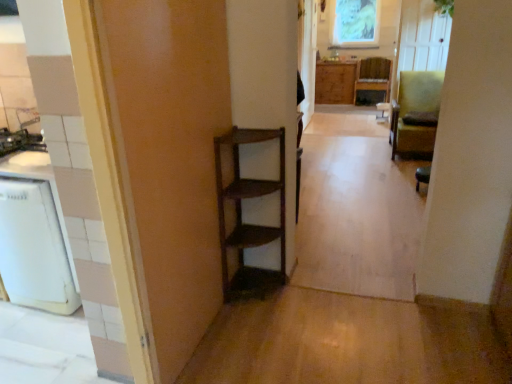
Question: From a real-world perspective, is wooden chair at center, the first chair positioned from the top, positioned above or below wooden cabinet at center?

Choices:
 (A) above
 (B) below

Answer: (B)

Question: In terms of height, does wooden chair at center, acting as the first chair starting from the back, look taller or shorter compared to wooden cabinet at center?

Choices:
 (A) tall
 (B) short

Answer: (B)

Question: Which of these objects is positioned closest to the green fabric chair at right, the 2th chair in the bottom-to-top sequence?

Choices:
 (A) wooden shelf at center
 (B) wooden cabinet at center
 (C) green textured fabric at upper center
 (D) wooden chair at center, the first chair positioned from the top
 (E) green fabric chair at right, which is the 1th chair in front-to-back order

Answer: (E)

Question: Which object is the closest to the green fabric chair at right, the 2th chair in the bottom-to-top sequence?

Choices:
 (A) green textured fabric at upper center
 (B) wooden cabinet at center
 (C) wooden shelf at center
 (D) wooden chair at center, acting as the first chair starting from the back
 (E) green fabric chair at right, the third chair in the top-to-bottom sequence

Answer: (E)